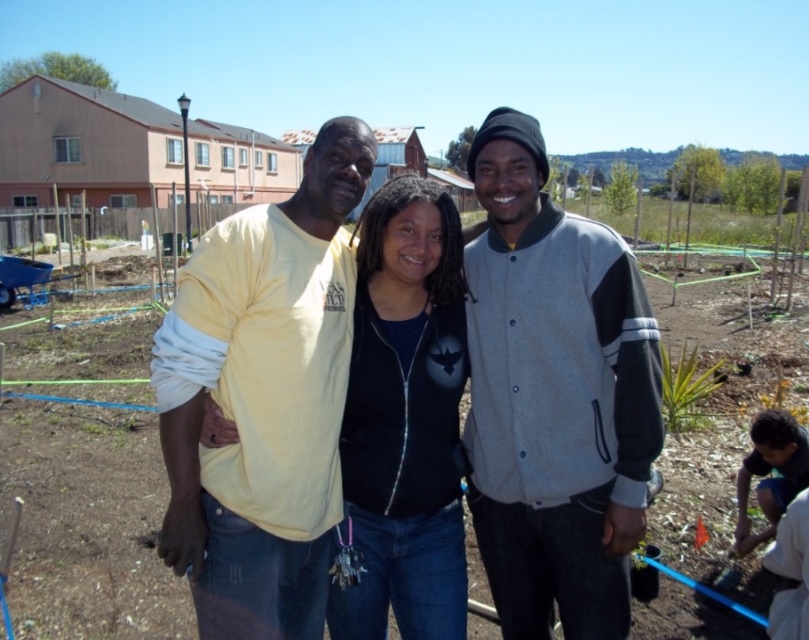
You are standing in the community garden and want to walk from point A to point B. Point A is at coordinate point (380, 627) and point B is at coordinate point (409, 388). Which direction should you move to get from point A to point B?

To move from point A at (380, 627) to point B at (409, 388), you should move towards the left since point A is further to the viewer than point B.

What is the color of the jacket worn by the person at the point with coordinates (553, 396)?

The point at coordinates (553, 396) is on the gray woolen jacket at center, so the color is gray.

You are a photographer trying to capture a group photo of the matte yellow shirt at center and the black matte jacket at center. Since you want to ensure both are in the frame, which direction should you position yourself relative to the group?

You should position yourself to the right of the group so that both the matte yellow shirt at center and the black matte jacket at center are fully visible in the frame.